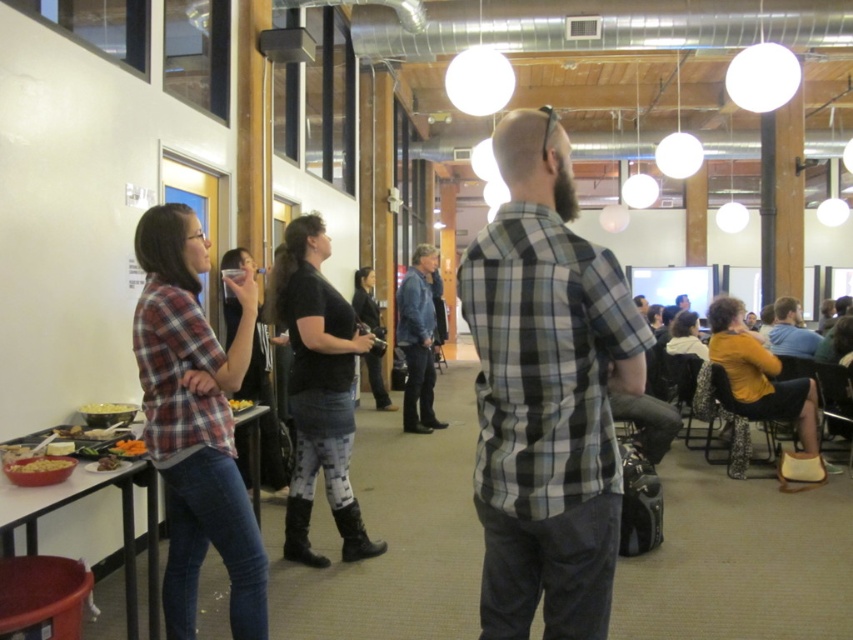
Does point (131, 452) lie in front of point (113, 461)?

That is False.

Which is behind, point (141, 454) or point (102, 468)?

The point (141, 454) is more distant.

Does point (144, 449) lie behind point (114, 465)?

That is True.

Where is `smooth brown bowl at lower left`? This screenshot has width=853, height=640. smooth brown bowl at lower left is located at coordinates (128, 448).

Can you confirm if wooden table at left is positioned to the left of matte yellow popcorn at lower left?

In fact, wooden table at left is to the right of matte yellow popcorn at lower left.

The height and width of the screenshot is (640, 853). Describe the element at coordinates (51, 500) in the screenshot. I see `wooden table at left` at that location.

Where is `wooden table at left`? wooden table at left is located at coordinates (51, 500).

Does plaid flannel shirt at left have a lesser width compared to smooth brown bowl at lower left?

Incorrect, plaid flannel shirt at left's width is not less than smooth brown bowl at lower left's.

I want to click on plaid flannel shirt at left, so click(195, 420).

Where is `plaid flannel shirt at left`? plaid flannel shirt at left is located at coordinates (195, 420).